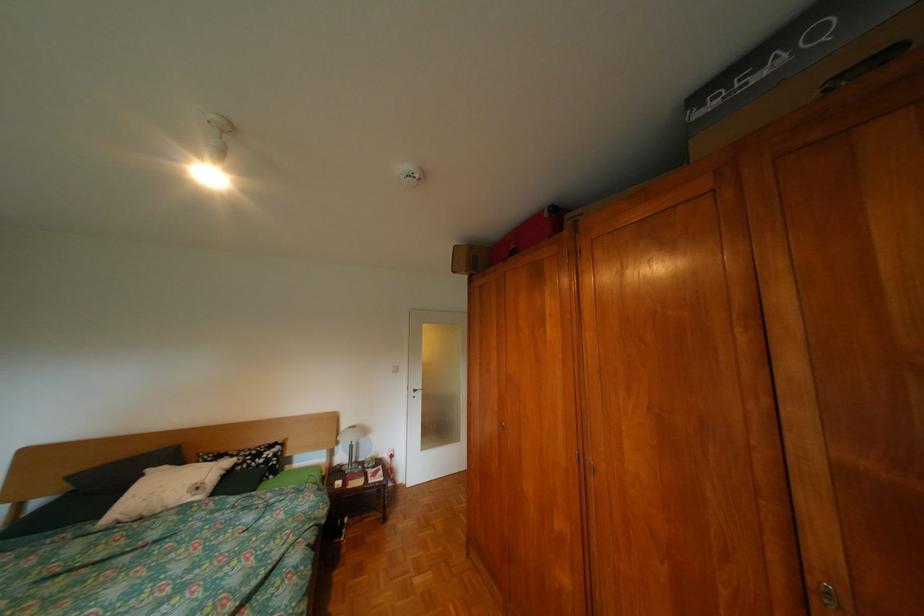
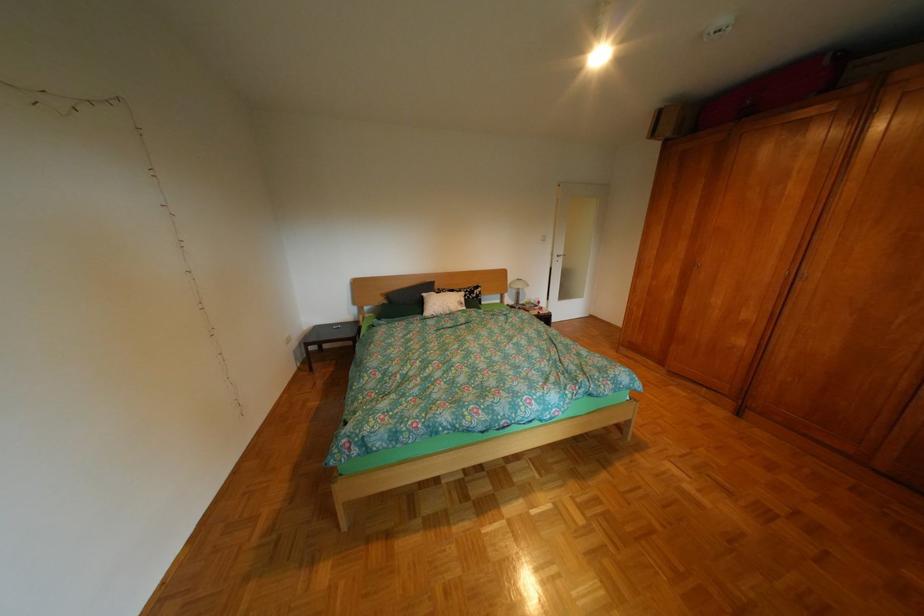
Locate, in the second image, the point that corresponds to (162,471) in the first image.

(439, 294)